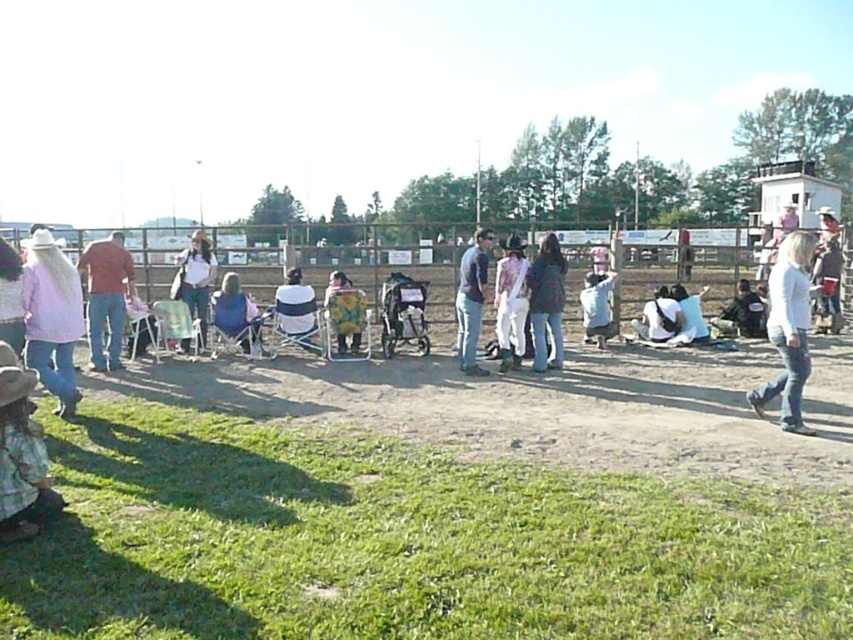
You are a GUI agent. You are given a task and a screenshot of the screen. Output one action in this format:
    pyautogui.click(x=<x>, y=<y>)
    Task: Click on the matte white shirt at center
    The image size is (853, 640).
    Given the screenshot: What is the action you would take?
    pyautogui.click(x=195, y=280)

Does point (201, 236) come in front of point (614, 273)?

Yes, it is in front of point (614, 273).

Between point (194, 301) and point (602, 308), which one is positioned behind?

Positioned behind is point (194, 301).

You are a GUI agent. You are given a task and a screenshot of the screen. Output one action in this format:
    pyautogui.click(x=<x>, y=<y>)
    Task: Click on the matte white shirt at center
    Image resolution: width=853 pixels, height=640 pixels.
    Given the screenshot: What is the action you would take?
    pyautogui.click(x=195, y=280)

Who is shorter, matte brown shirt at center or light blue denim shirt at center?

light blue denim shirt at center

You are a GUI agent. You are given a task and a screenshot of the screen. Output one action in this format:
    pyautogui.click(x=<x>, y=<y>)
    Task: Click on the matte brown shirt at center
    Image resolution: width=853 pixels, height=640 pixels.
    Given the screenshot: What is the action you would take?
    pyautogui.click(x=106, y=296)

The width and height of the screenshot is (853, 640). In order to click on matte brown shirt at center in this screenshot , I will do `click(106, 296)`.

Which is above, blue denim jeans at center or light blue denim shirt at center?

Positioned higher is light blue denim shirt at center.

Based on the photo, who is more forward, (x=482, y=298) or (x=585, y=336)?

Point (x=482, y=298) is more forward.

This screenshot has width=853, height=640. I want to click on blue denim jeans at center, so click(471, 300).